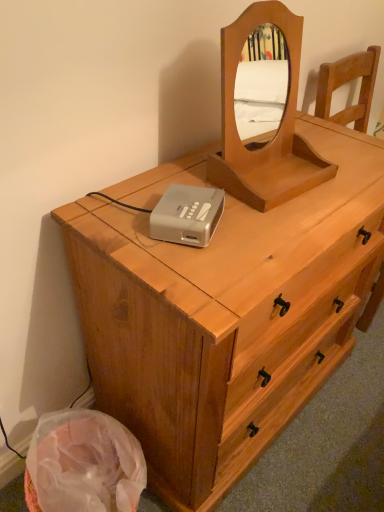
Question: Is light brown wood chest of drawers at center wider than silver plastic cassette at center?

Choices:
 (A) yes
 (B) no

Answer: (A)

Question: Would you say light brown wood chest of drawers at center is a long distance from silver plastic cassette at center?

Choices:
 (A) no
 (B) yes

Answer: (A)

Question: Considering the relative positions of light brown wood chest of drawers at center and silver plastic cassette at center in the image provided, is light brown wood chest of drawers at center to the left of silver plastic cassette at center from the viewer's perspective?

Choices:
 (A) no
 (B) yes

Answer: (A)

Question: Does light brown wood chest of drawers at center have a lesser height compared to silver plastic cassette at center?

Choices:
 (A) no
 (B) yes

Answer: (A)

Question: Considering the relative sizes of light brown wood chest of drawers at center and silver plastic cassette at center in the image provided, is light brown wood chest of drawers at center smaller than silver plastic cassette at center?

Choices:
 (A) yes
 (B) no

Answer: (B)

Question: Does light brown wood chest of drawers at center have a greater height compared to silver plastic cassette at center?

Choices:
 (A) yes
 (B) no

Answer: (A)

Question: Is light brown wooden mirror at upper center with silver plastic cassette at center?

Choices:
 (A) no
 (B) yes

Answer: (A)

Question: Considering the relative positions of light brown wooden mirror at upper center and silver plastic cassette at center in the image provided, is light brown wooden mirror at upper center to the left of silver plastic cassette at center from the viewer's perspective?

Choices:
 (A) yes
 (B) no

Answer: (B)

Question: Would you say light brown wooden mirror at upper center is a long distance from silver plastic cassette at center?

Choices:
 (A) yes
 (B) no

Answer: (B)

Question: Can you confirm if light brown wooden mirror at upper center is taller than silver plastic cassette at center?

Choices:
 (A) no
 (B) yes

Answer: (B)

Question: Is light brown wooden mirror at upper center looking in the opposite direction of silver plastic cassette at center?

Choices:
 (A) no
 (B) yes

Answer: (A)

Question: From a real-world perspective, is light brown wooden mirror at upper center physically below silver plastic cassette at center?

Choices:
 (A) no
 (B) yes

Answer: (A)

Question: Considering the relative sizes of silver plastic cassette at center and light brown wooden mirror at upper center in the image provided, is silver plastic cassette at center smaller than light brown wooden mirror at upper center?

Choices:
 (A) no
 (B) yes

Answer: (B)